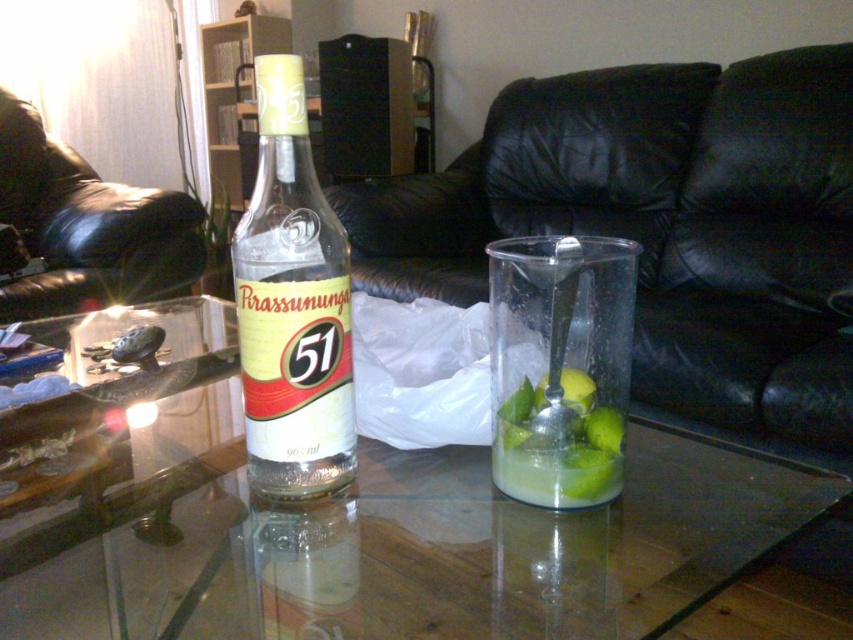
Which of these two, black leather couch at center or black leather couch at left, stands taller?

Standing taller between the two is black leather couch at center.

Consider the image. Who is more distant from viewer, (766, 353) or (61, 145)?

Positioned behind is point (61, 145).

In order to click on black leather couch at center in this screenshot , I will do `click(664, 228)`.

Is transparent glass table at center to the right of clear glass bottle at center from the viewer's perspective?

In fact, transparent glass table at center is to the left of clear glass bottle at center.

Is transparent glass table at center bigger than clear glass bottle at center?

Indeed, transparent glass table at center has a larger size compared to clear glass bottle at center.

Is point (178, 401) positioned before point (288, 276)?

No, (178, 401) is behind (288, 276).

Where is `transparent glass table at center`? transparent glass table at center is located at coordinates (387, 544).

Who is more forward, (10, 195) or (579, 412)?

Point (579, 412) is in front.

Who is taller, black leather couch at left or green matte lime at center?

Standing taller between the two is black leather couch at left.

Where is `black leather couch at left`? black leather couch at left is located at coordinates (86, 227).